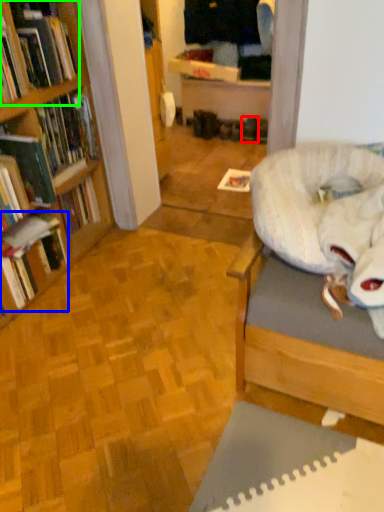
Question: Based on their relative distances, which object is nearer to footwear (highlighted by a red box)? Choose from book (highlighted by a blue box) and book (highlighted by a green box).

Choices:
 (A) book
 (B) book

Answer: (B)